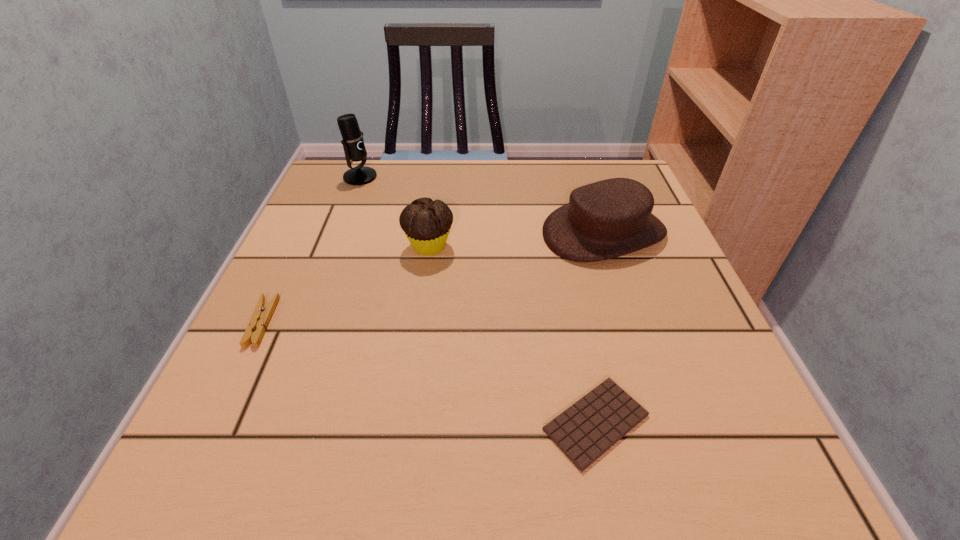
Choose which object is the fourth nearest neighbor to the third object from right to left. Please provide its 2D coordinates. Your answer should be formatted as a tuple, i.e. [(x, y)], where the tuple contains the x and y coordinates of a point satisfying the conditions above.

[(586, 430)]

You are a GUI agent. You are given a task and a screenshot of the screen. Output one action in this format:
    pyautogui.click(x=<x>, y=<y>)
    Task: Click on the object that stands as the closest to the third object from left to right
    Image resolution: width=960 pixels, height=540 pixels.
    Given the screenshot: What is the action you would take?
    pyautogui.click(x=610, y=218)

What are the coordinates of `vacant region that satisfies the following two spatial constraints: 1. on the back side of the fourth farthest object; 2. on the right side of the third object from left to right` in the screenshot? It's located at pyautogui.click(x=298, y=246).

Find the location of a particular element. free space that satisfies the following two spatial constraints: 1. on the back side of the third object from left to right; 2. on the right side of the second nearest object is located at coordinates (298, 246).

I want to click on free region that satisfies the following two spatial constraints: 1. on the back side of the hat; 2. on the right side of the second nearest object, so click(304, 232).